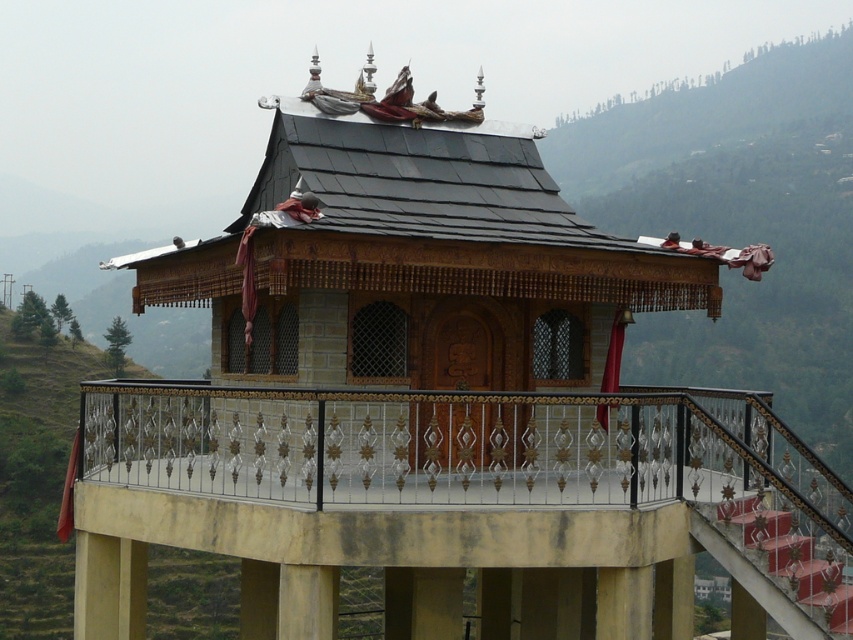
You are standing in the traditional pavilion and want to exit to the balcony. Which direction should you walk to reach the metallic wrought iron balcony at center from the wooden gazebo at center?

The metallic wrought iron balcony at center is to the right of the wooden gazebo at center, so you should walk towards the right side to reach it.

You are standing at the base of the hill looking up at the pavilion. There is a point marked at coordinates (460, 508). Based on the scene description, where is this point located?

The point is located on the metallic wrought iron balcony at center of the pavilion.